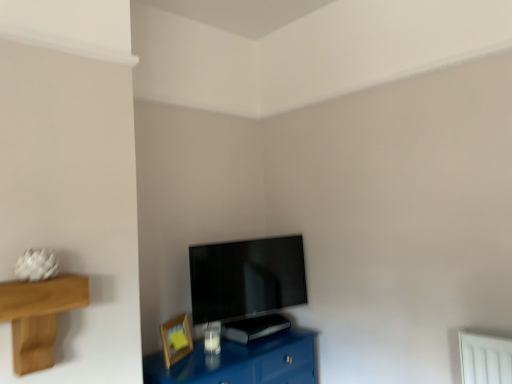
Question: Is flat screen tv at center inside glossy blue table at lower center?

Choices:
 (A) no
 (B) yes

Answer: (A)

Question: Could you tell me if glossy blue table at lower center is facing flat screen tv at center?

Choices:
 (A) yes
 (B) no

Answer: (B)

Question: Considering the relative positions of glossy blue table at lower center and flat screen tv at center in the image provided, is glossy blue table at lower center to the right of flat screen tv at center from the viewer's perspective?

Choices:
 (A) no
 (B) yes

Answer: (A)

Question: Is glossy blue table at lower center taller than flat screen tv at center?

Choices:
 (A) no
 (B) yes

Answer: (A)

Question: Considering the relative sizes of glossy blue table at lower center and flat screen tv at center in the image provided, is glossy blue table at lower center bigger than flat screen tv at center?

Choices:
 (A) no
 (B) yes

Answer: (B)

Question: Considering the relative sizes of glossy blue table at lower center and flat screen tv at center in the image provided, is glossy blue table at lower center wider than flat screen tv at center?

Choices:
 (A) no
 (B) yes

Answer: (B)

Question: From the image's perspective, is wooden picture frame at lower left located above flat screen tv at center?

Choices:
 (A) yes
 (B) no

Answer: (B)

Question: From the image's perspective, would you say wooden picture frame at lower left is shown under flat screen tv at center?

Choices:
 (A) yes
 (B) no

Answer: (A)

Question: From a real-world perspective, is wooden picture frame at lower left located beneath flat screen tv at center?

Choices:
 (A) no
 (B) yes

Answer: (B)

Question: Is wooden picture frame at lower left oriented towards flat screen tv at center?

Choices:
 (A) no
 (B) yes

Answer: (A)

Question: Considering the relative sizes of wooden picture frame at lower left and flat screen tv at center in the image provided, is wooden picture frame at lower left shorter than flat screen tv at center?

Choices:
 (A) yes
 (B) no

Answer: (A)

Question: Is wooden picture frame at lower left at the right side of flat screen tv at center?

Choices:
 (A) yes
 (B) no

Answer: (B)

Question: From the image's perspective, is flat screen tv at center beneath glossy blue table at lower center?

Choices:
 (A) no
 (B) yes

Answer: (A)